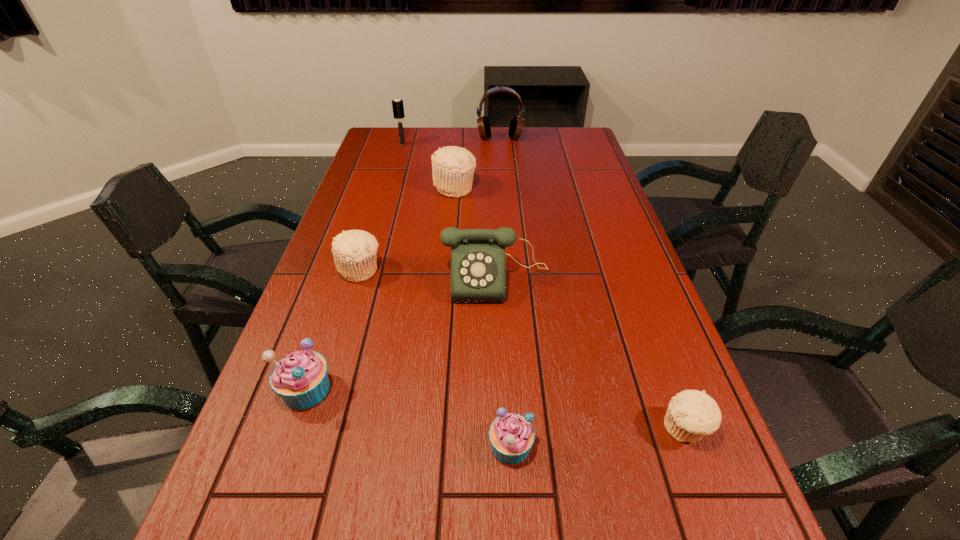
Identify the location of vacant space situated 0.160m on the back of the rightmost object. (655, 345).

Find the location of `headset at the far edge`. headset at the far edge is located at coordinates (516, 126).

The image size is (960, 540). I want to click on hairbrush situated at the far edge, so click(398, 110).

Locate an element on the screen. The width and height of the screenshot is (960, 540). hairbrush located at the left edge is located at coordinates (398, 110).

What are the coordinates of `object that is at the right edge` in the screenshot? It's located at (691, 414).

Identify the location of object that is at the far left corner. This screenshot has width=960, height=540. (398, 110).

The height and width of the screenshot is (540, 960). I want to click on free region at the far edge, so click(506, 150).

This screenshot has width=960, height=540. What are the coordinates of `vacant space at the left edge of the desktop` in the screenshot? It's located at (374, 211).

Locate an element on the screen. vacant space at the right edge of the desktop is located at coordinates (572, 189).

The height and width of the screenshot is (540, 960). Find the location of `free space between the black headset and the telephone`. free space between the black headset and the telephone is located at coordinates (498, 208).